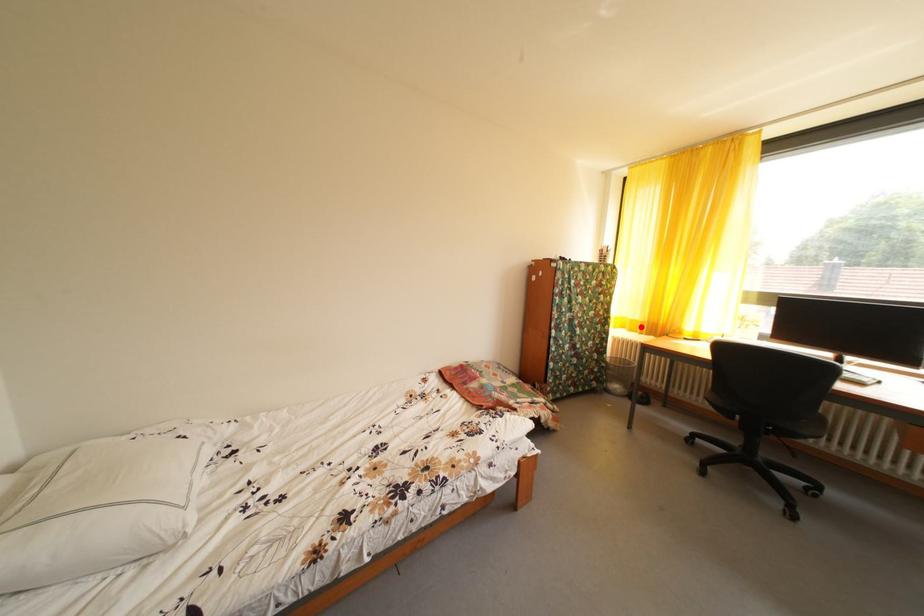
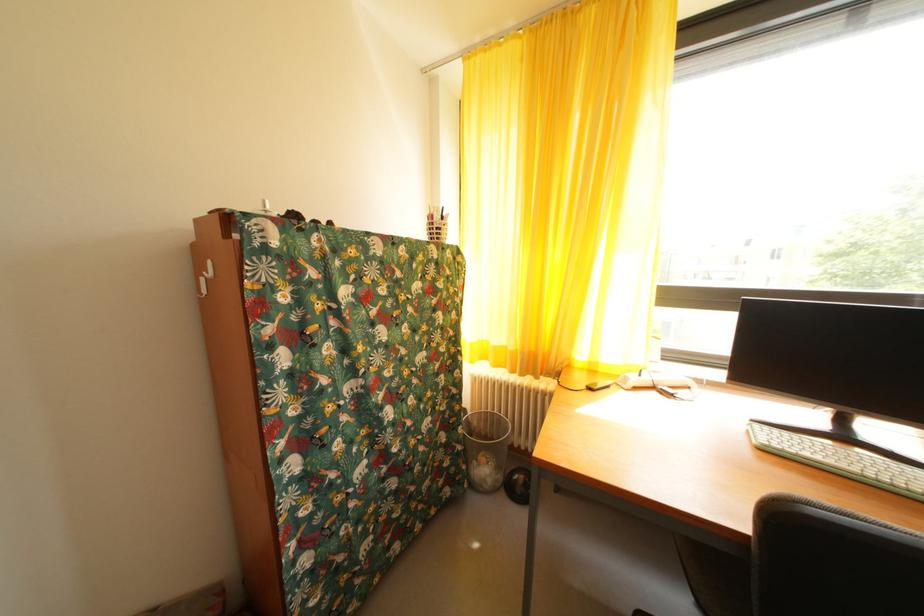
Where in the second image is the point corresponding to the highlighted location from the first image?

(505, 354)